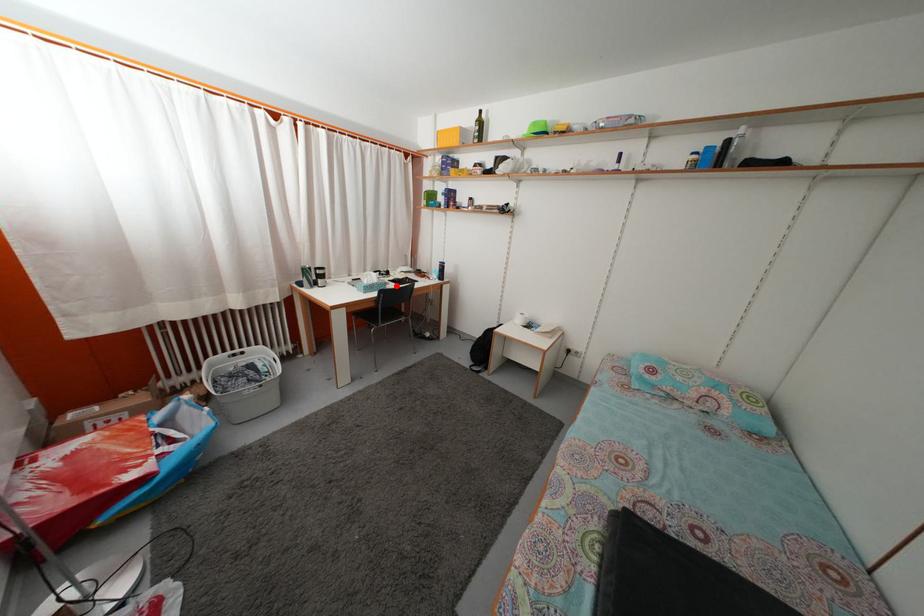
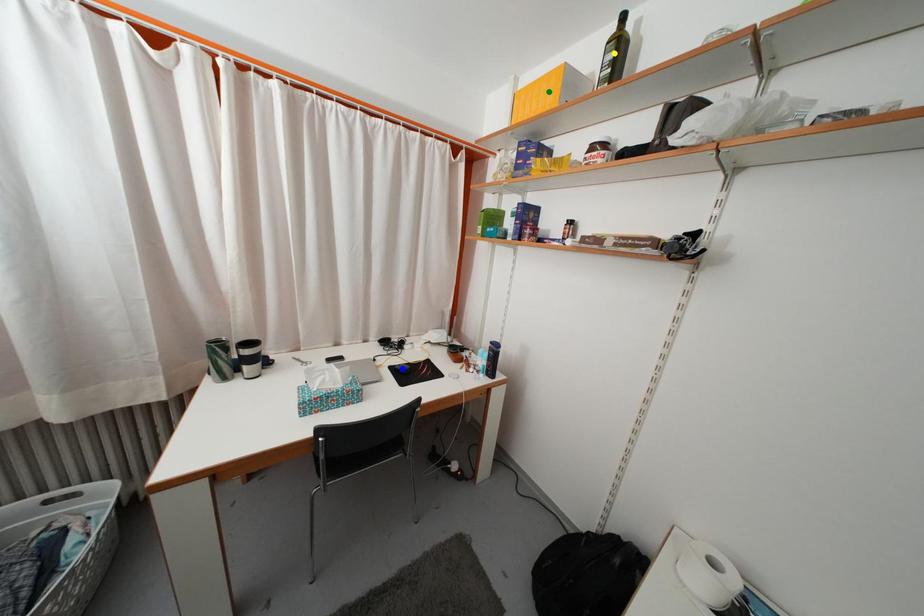
Question: I am providing you with two images of the same scene from different viewpoints. A red point is marked on the first image. You are given multiple points on the second image. Which spot in image 2 lines up with the point in image 1?

Choices:
 (A) green point
 (B) blue point
 (C) yellow point

Answer: (B)